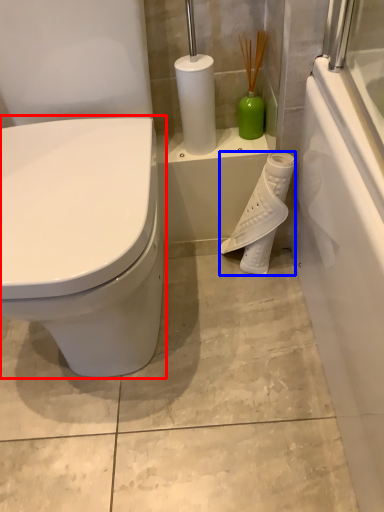
Question: Which point is further to the camera, toilet (highlighted by a red box) or toilet paper (highlighted by a blue box)?

Choices:
 (A) toilet
 (B) toilet paper

Answer: (B)